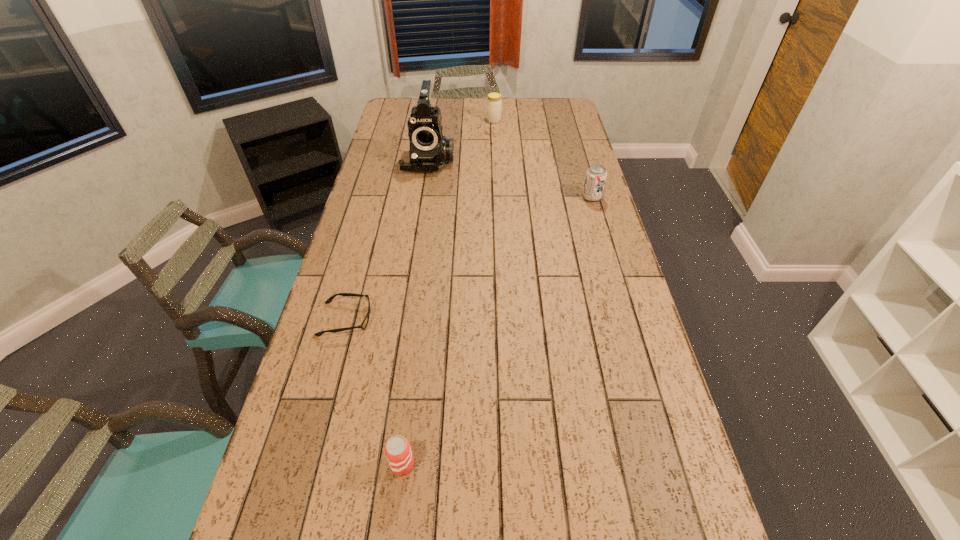
At what (x,y) coordinates should I click in order to perform the action: click on unoccupied area between the camcorder and the spectacles. Please return your answer as a coordinate pair (x, y). The image size is (960, 540). Looking at the image, I should click on (387, 240).

Identify which object is located as the third nearest to the left beer can. Please provide its 2D coordinates. Your answer should be formatted as a tuple, i.e. [(x, y)], where the tuple contains the x and y coordinates of a point satisfying the conditions above.

[(429, 150)]

Identify which object is located as the nearest to the nearest object. Please provide its 2D coordinates. Your answer should be formatted as a tuple, i.e. [(x, y)], where the tuple contains the x and y coordinates of a point satisfying the conditions above.

[(364, 324)]

Locate an element on the screen. vacant area in the image that satisfies the following two spatial constraints: 1. on the front side of the fourth object from left to right; 2. on the front-facing side of the shortest object is located at coordinates (503, 319).

The height and width of the screenshot is (540, 960). Find the location of `free location that satisfies the following two spatial constraints: 1. on the front-facing side of the nearer beer can; 2. on the right side of the second nearest object`. free location that satisfies the following two spatial constraints: 1. on the front-facing side of the nearer beer can; 2. on the right side of the second nearest object is located at coordinates (307, 464).

Find the location of a particular element. The width and height of the screenshot is (960, 540). blank space that satisfies the following two spatial constraints: 1. on the front-facing side of the spectacles; 2. on the back side of the nearest object is located at coordinates (x=307, y=464).

In order to click on vacant space that satisfies the following two spatial constraints: 1. on the front-facing side of the fourth farthest object; 2. on the right side of the fourth tallest object in this screenshot , I will do `click(307, 464)`.

Locate an element on the screen. The image size is (960, 540). vacant space that satisfies the following two spatial constraints: 1. on the lens mount of the camcorder; 2. on the front-facing side of the fourth farthest object is located at coordinates (404, 319).

Locate an element on the screen. The image size is (960, 540). free point that satisfies the following two spatial constraints: 1. on the front-facing side of the second shortest object; 2. on the left side of the shortest object is located at coordinates pos(307,464).